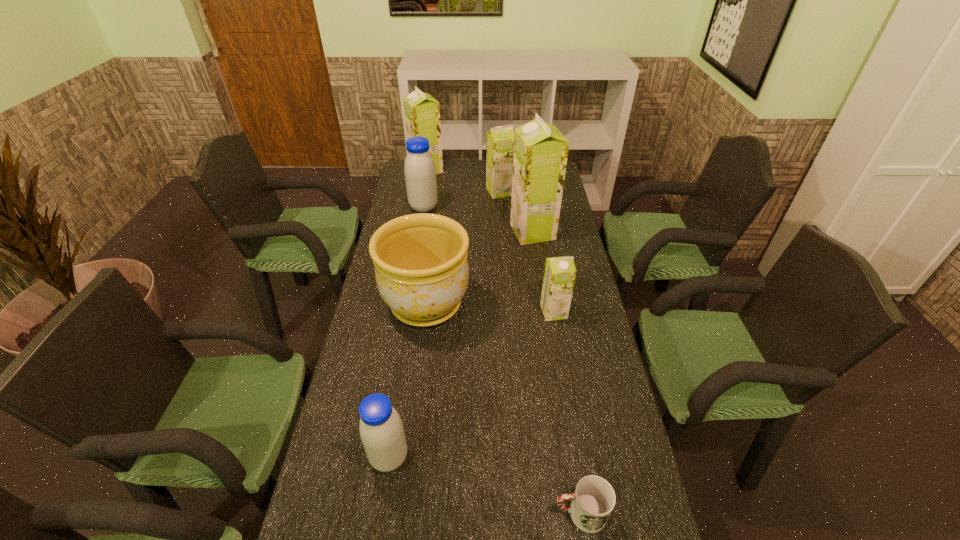
You are a GUI agent. You are given a task and a screenshot of the screen. Output one action in this format:
    pyautogui.click(x=<x>, y=<y>)
    Task: Click on the object identified as the second closest to the second nearest soya milk
    
    Given the screenshot: What is the action you would take?
    pyautogui.click(x=540, y=150)

Identify which object is the sixth nearest to the second farthest soya milk. Please provide its 2D coordinates. Your answer should be formatted as a tuple, i.e. [(x, y)], where the tuple contains the x and y coordinates of a point satisfying the conditions above.

[(381, 429)]

You are a GUI agent. You are given a task and a screenshot of the screen. Output one action in this format:
    pyautogui.click(x=<x>, y=<y>)
    Task: Click on the soya milk identified as the third closest to the smallest green soya milk
    
    Given the screenshot: What is the action you would take?
    pyautogui.click(x=420, y=172)

Where is `soya milk that is the second closest to the flowerpot`? This screenshot has height=540, width=960. soya milk that is the second closest to the flowerpot is located at coordinates (540, 150).

Locate an element on the screen. The image size is (960, 540). green soya milk that can be found as the second closest to the tallest soya milk is located at coordinates (559, 275).

Select which green soya milk is the third closest to the farthest object. Please provide its 2D coordinates. Your answer should be formatted as a tuple, i.e. [(x, y)], where the tuple contains the x and y coordinates of a point satisfying the conditions above.

[(559, 275)]

This screenshot has height=540, width=960. I want to click on free space that satisfies the following two spatial constraints: 1. on the front side of the smaller blue soya milk; 2. on the left side of the third farthest soya milk, so click(x=381, y=457).

At what (x,y) coordinates should I click in order to perform the action: click on vacant point that satisfies the following two spatial constraints: 1. on the front side of the fifth nearest object; 2. on the left side of the sixth nearest object. Please return your answer as a coordinate pair (x, y). Looking at the image, I should click on (420, 232).

This screenshot has width=960, height=540. In order to click on blank space that satisfies the following two spatial constraints: 1. on the back side of the smaller blue soya milk; 2. on the right side of the flowerpot in this screenshot , I will do `click(414, 305)`.

At what (x,y) coordinates should I click in order to perform the action: click on vacant area in the image that satisfies the following two spatial constraints: 1. on the side of the nearest object where the handle is located; 2. on the front side of the second smallest green soya milk. Please return your answer as a coordinate pair (x, y). Looking at the image, I should click on (530, 192).